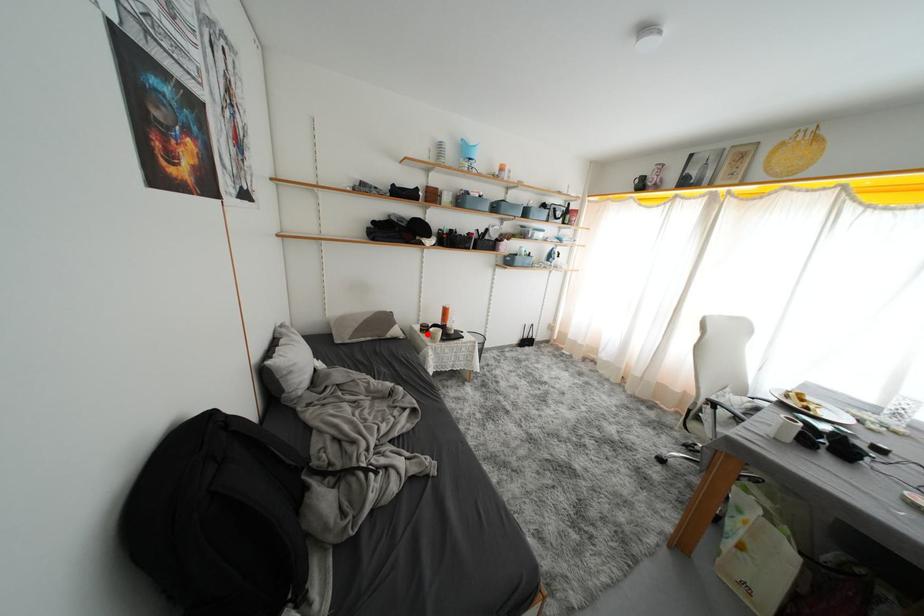
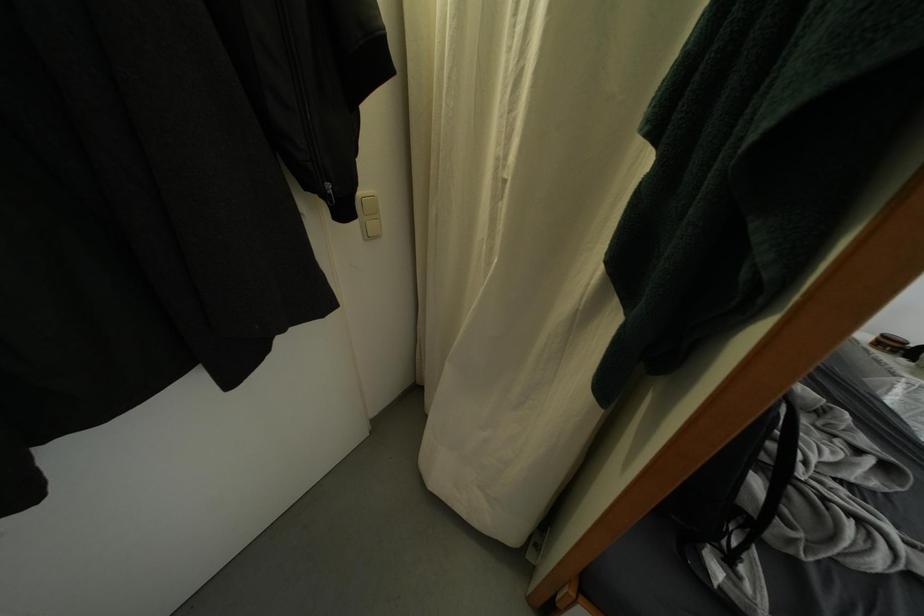
Find the pixel in the second image that matches the highlighted location in the first image.

(884, 347)